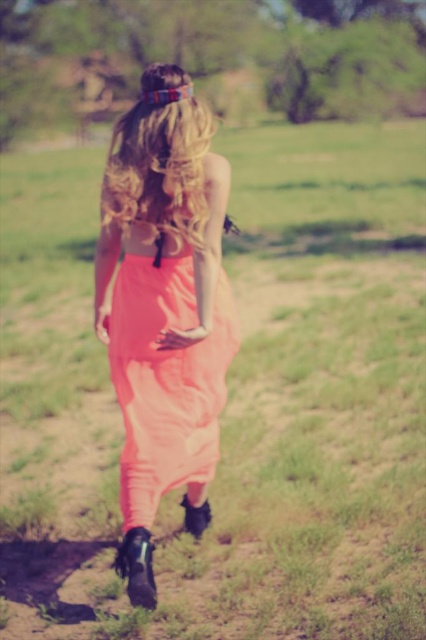
Question: Does coral fabric skirt at center have a greater width compared to blonde hair at center?

Choices:
 (A) yes
 (B) no

Answer: (A)

Question: Which object appears farthest from the camera in this image?

Choices:
 (A) blonde hair at center
 (B) coral fabric skirt at center
 (C) coral fabric dress at center

Answer: (C)

Question: Is coral fabric skirt at center further to the viewer compared to blonde hair at center?

Choices:
 (A) yes
 (B) no

Answer: (B)

Question: Can you confirm if coral fabric skirt at center is smaller than blonde hair at center?

Choices:
 (A) no
 (B) yes

Answer: (A)

Question: Which object is closer to the camera taking this photo?

Choices:
 (A) coral fabric skirt at center
 (B) blonde hair at center
 (C) coral fabric dress at center

Answer: (A)

Question: Which object appears farthest from the camera in this image?

Choices:
 (A) coral fabric dress at center
 (B) blonde hair at center

Answer: (A)